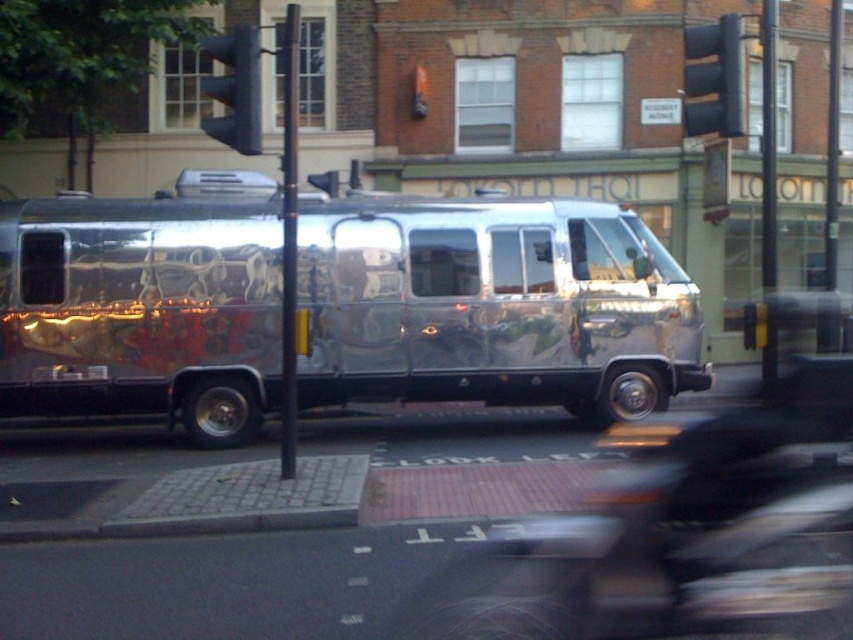
You are a delivery person trying to find the shiny metallic van at center for loading packages. Using the coordinates provided, can you confirm if the point at [492,305] is the correct location of the van?

Yes, the point at [492,305] marks the shiny metallic van at center, so it is the correct location for loading packages.

You are a delivery driver who needs to park your shiny metallic van at center in a parking spot located at coordinates 0.5, 0.6. Can you park your van there without moving it from its current position?

The shiny metallic van at center is currently at position (x=492, y=305), which is very close to the parking spot at (x=511, y=320). Since the coordinates are nearly the same, the van is already positioned correctly and can be parked there without moving it.

Based on the photo, you are a delivery driver who needs to park your van near the reflective silver van. The parking spot requires that you stay within 5 meters of both the black plastic traffic light at upper right and the blue plastic traffic light at upper center. Is this possible?

The black plastic traffic light at upper right is 6.85 meters away from the blue plastic traffic light at upper center. Since the required distance to stay within 5 meters of both is not possible as the distance between them exceeds 5 meters, the driver cannot park within the required distance of both.